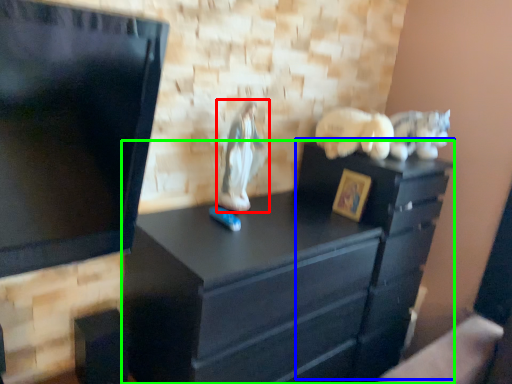
Question: Estimate the real-world distances between objects in this image. Which object is farther from animal (highlighted by a red box), file cabinet (highlighted by a blue box) or chest of drawers (highlighted by a green box)?

Choices:
 (A) file cabinet
 (B) chest of drawers

Answer: (A)